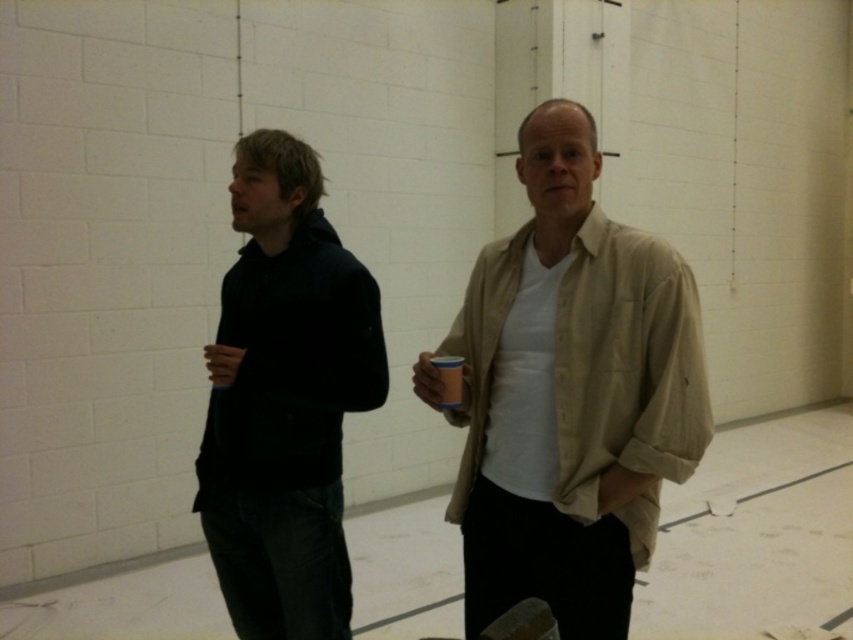
Which is below, beige cotton shirt at center or dark blue hoodie at left?

dark blue hoodie at left is lower down.

Does beige cotton shirt at center have a greater width compared to dark blue hoodie at left?

Indeed, beige cotton shirt at center has a greater width compared to dark blue hoodie at left.

You are a GUI agent. You are given a task and a screenshot of the screen. Output one action in this format:
    pyautogui.click(x=<x>, y=<y>)
    Task: Click on the beige cotton shirt at center
    
    Given the screenshot: What is the action you would take?
    pyautogui.click(x=569, y=394)

This screenshot has height=640, width=853. In order to click on beige cotton shirt at center in this screenshot , I will do `click(569, 394)`.